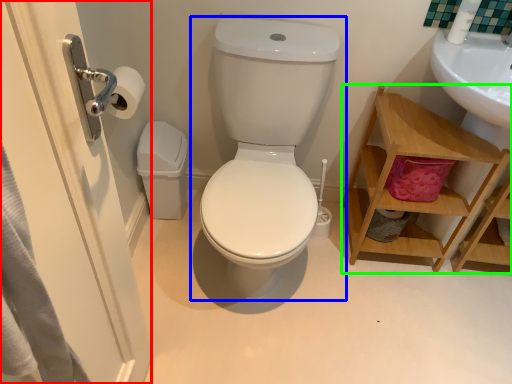
Question: Which is nearer to the screen door (highlighted by a red box)? toilet (highlighted by a blue box) or shelf (highlighted by a green box).

Choices:
 (A) toilet
 (B) shelf

Answer: (A)